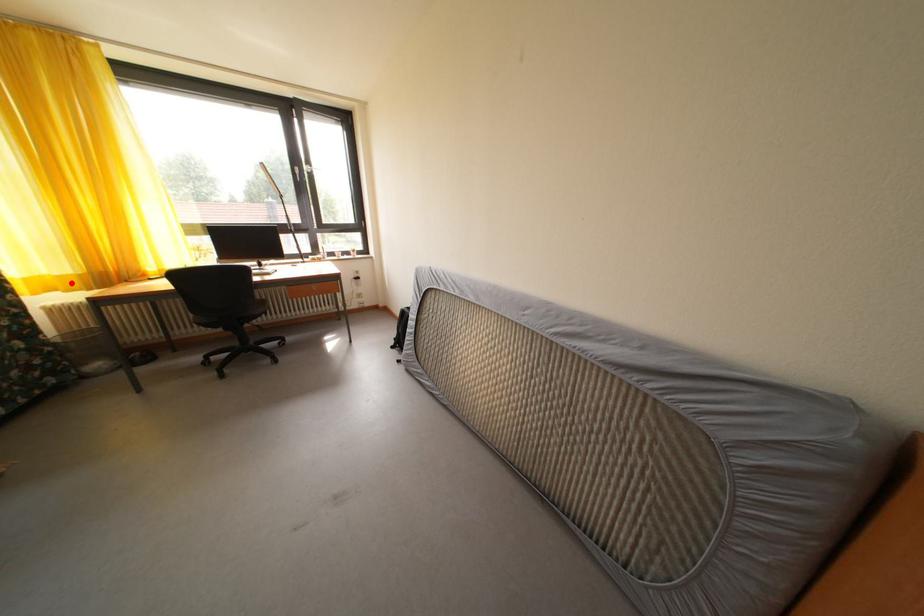
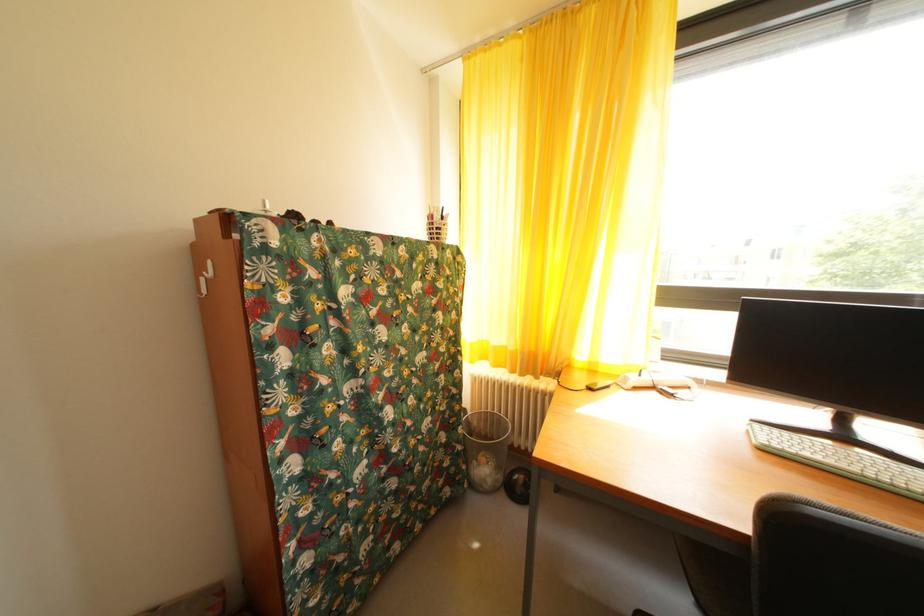
Question: I am providing you with two images of the same scene from different viewpoints. A red point is shown in image1. For the corresponding object point in image2, is it positioned nearer or farther from the camera?

Choices:
 (A) Nearer
 (B) Farther

Answer: (A)